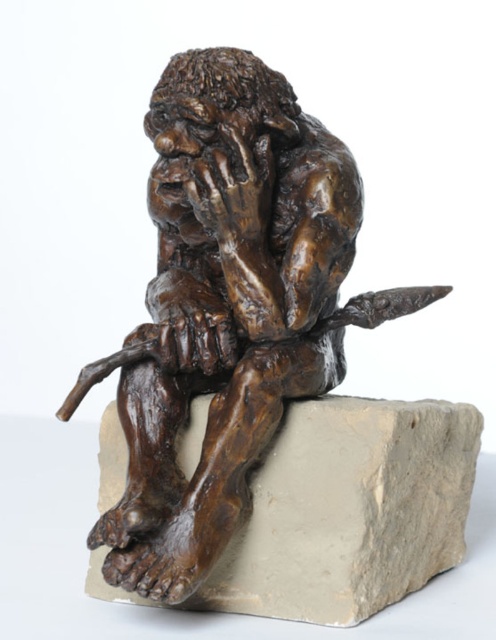
You are an art curator planning to display the bronze statue at center and the gray stone at center in a new exhibition. Given their sizes, which object should be placed on a pedestal to ensure visibility for visitors?

The bronze statue at center is larger than the gray stone at center, so it should be placed on a pedestal to ensure visitors can view it properly.

You are an art conservator examining the bronze statue at center and the gray stone at center. Based on their positions, which object is situated higher in the image?

The bronze statue at center is located above the gray stone at center, so it is situated higher in the image.

You are standing in front of the bronze sculpture of the caveman. There are two points marked on the base of the sculpture. The first point is at coordinates point [202,292] and the second point is at point [219,580]. From your perspective, which point is closer to you?

Point [219,580] is closer to you because it is in front of point [202,292].